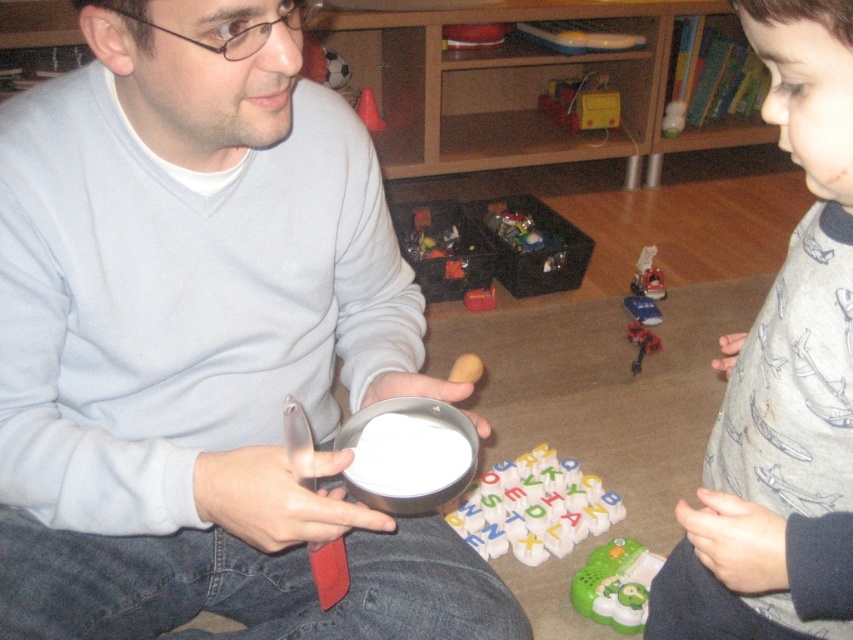
Does metallic yellow train at center appear on the left side of metallic silver spoon at center?

No, metallic yellow train at center is not to the left of metallic silver spoon at center.

Who is positioned more to the left, metallic yellow train at center or metallic silver spoon at center?

From the viewer's perspective, metallic silver spoon at center appears more on the left side.

At what (x,y) coordinates should I click in order to perform the action: click on metallic yellow train at center. Please return your answer as a coordinate pair (x, y). The width and height of the screenshot is (853, 640). Looking at the image, I should click on (581, 102).

At what (x,y) coordinates should I click in order to perform the action: click on metallic yellow train at center. Please return your answer as a coordinate pair (x, y). This screenshot has height=640, width=853. Looking at the image, I should click on (581, 102).

Who is lower down, metallic silver bowl at center or metallic plastic toy car at center?

metallic silver bowl at center

Measure the distance between point (181, 1) and camera.

Point (181, 1) is 25.57 inches from camera.

Where is `metallic silver bowl at center`? The width and height of the screenshot is (853, 640). metallic silver bowl at center is located at coordinates (202, 342).

Between green plastic toy at lower right and metallic plastic toy car at center, which one has less height?

metallic plastic toy car at center

Locate an element on the screen. The height and width of the screenshot is (640, 853). green plastic toy at lower right is located at coordinates click(x=614, y=584).